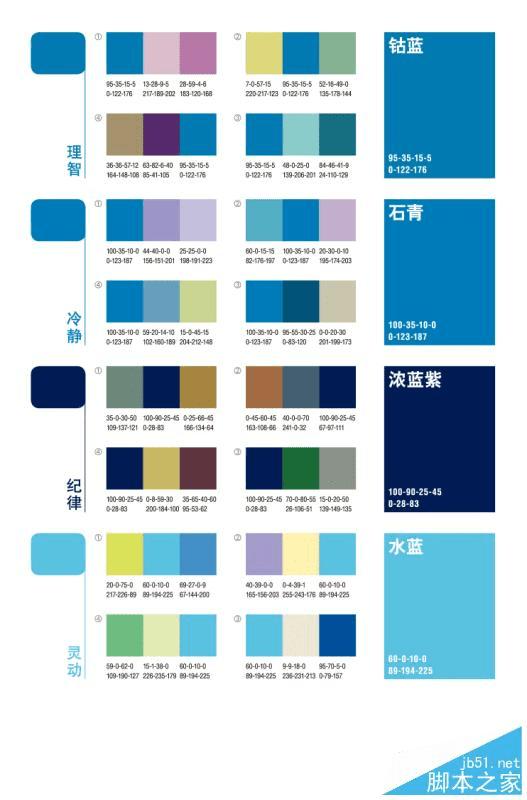
You are a GUI agent. You are given a task and a screenshot of the screen. Output one action in this format:
    pyautogui.click(x=<x>, y=<y>)
    Task: Click on the big blue paint swatches
    The height and width of the screenshot is (800, 527).
    Given the screenshot: What is the action you would take?
    pyautogui.click(x=409, y=78), pyautogui.click(x=409, y=568), pyautogui.click(x=409, y=426), pyautogui.click(x=409, y=254)